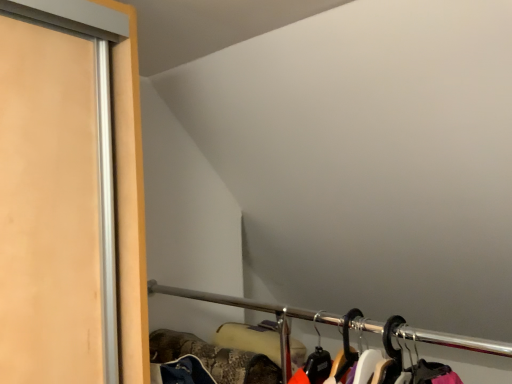
Based on the photo, what is the approximate width of velvet fabric coat at lower center?

velvet fabric coat at lower center is 8.78 centimeters wide.

What do you see at coordinates (342, 326) in the screenshot? Image resolution: width=512 pixels, height=384 pixels. I see `velvet fabric coat at lower center` at bounding box center [342, 326].

At what (x,y) coordinates should I click in order to perform the action: click on velvet fabric coat at lower center. Please return your answer as a coordinate pair (x, y). The width and height of the screenshot is (512, 384). Looking at the image, I should click on [342, 326].

Measure the distance between point [252,305] and camera.

A distance of 5.24 feet exists between point [252,305] and camera.

What are the coordinates of `velvet fabric coat at lower center` in the screenshot? It's located at click(x=342, y=326).